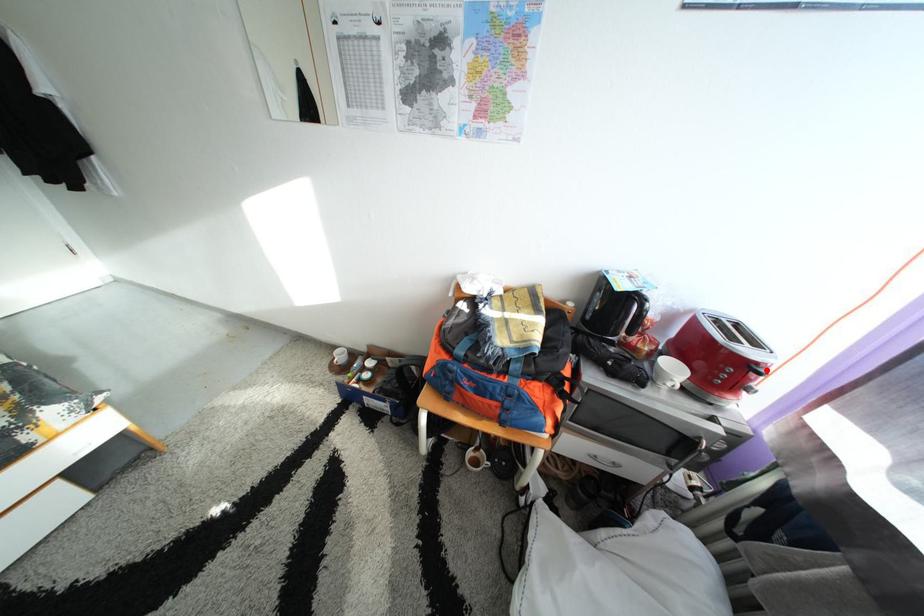
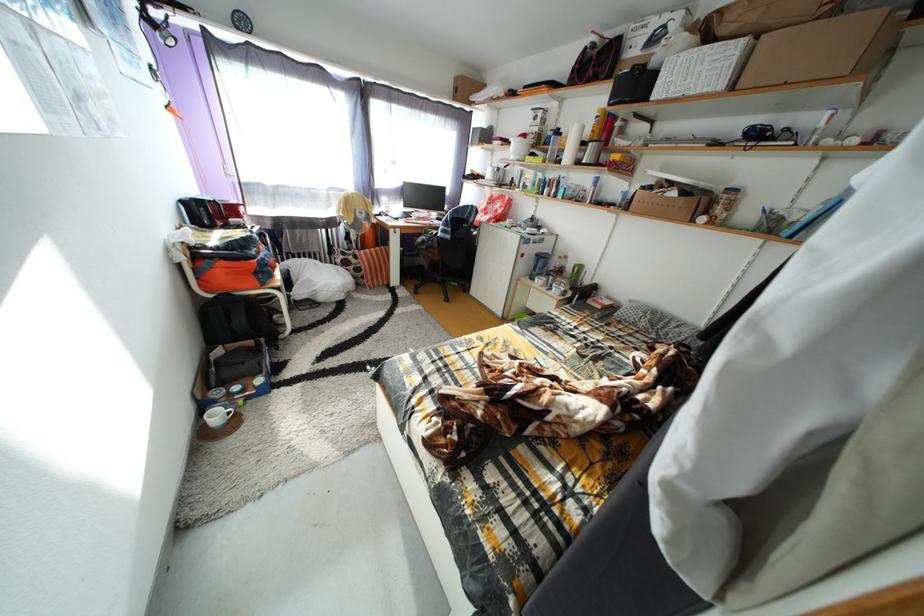
Question: I am providing you with two images of the same scene from different viewpoints. A red point is marked on the first image. Can you still see the location of the red point in image 2?

Choices:
 (A) Yes
 (B) No

Answer: (B)